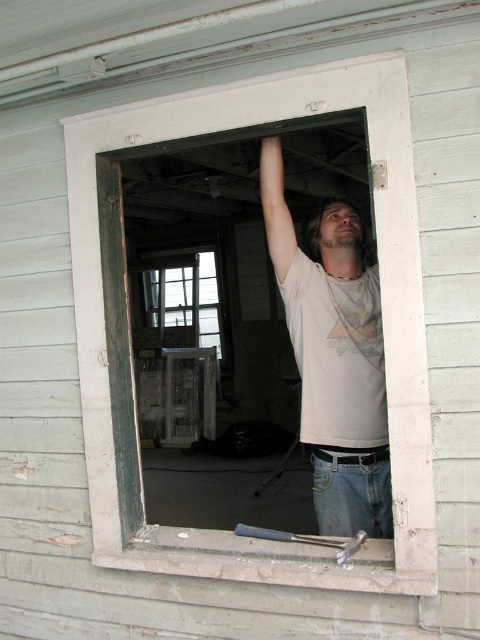
You are a painter standing in front of the window frame. You need to place a canvas on the white painted wood at center and hang a small painting on the white cotton shirt at center. Which surface will the canvas occupy more of?

The white painted wood at center is bigger than the white cotton shirt at center, so the canvas will occupy more of the white painted wood at center.

You are an interior designer assessing the room through the window. You notice the white painted wood at center and the white cotton shirt at center. Which object is nearer to the window?

The white painted wood at center is closer to the viewer than the white cotton shirt at center, so the white painted wood at center is nearer to the window.

You are looking through the window of an old building and see a man inside. There is a point marked at coordinates [129,330]. What object is located at that point?

The point at coordinates [129,330] corresponds to the white painted wood at center.